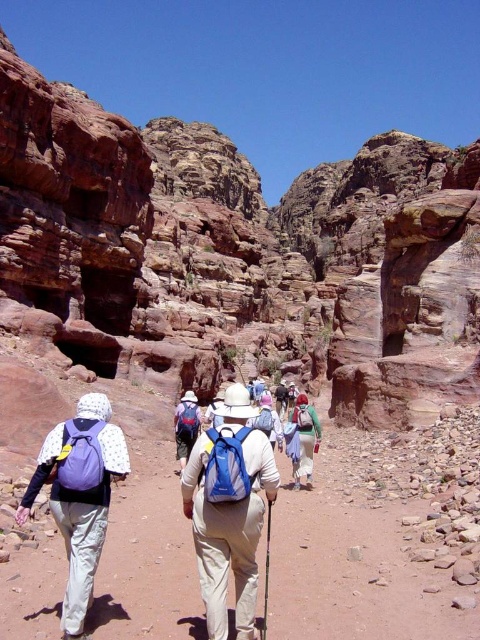
Can you confirm if purple fabric backpack at center-left is wider than matte blue backpack at center?

Yes.

What do you see at coordinates (80, 496) in the screenshot? I see `purple fabric backpack at center-left` at bounding box center [80, 496].

Identify the location of purple fabric backpack at center-left. (80, 496).

Who is shorter, purple fabric backpack at center-left or light brown leather backpack at center?

light brown leather backpack at center

Does purple fabric backpack at center-left lie in front of light brown leather backpack at center?

Yes.

Is point (17, 513) closer to viewer compared to point (278, 410)?

Yes, point (17, 513) is in front of point (278, 410).

Where is `purple fabric backpack at center-left`? This screenshot has width=480, height=640. purple fabric backpack at center-left is located at coordinates (80, 496).

Can you confirm if green fabric backpack at center is positioned above light brown leather backpack at center?

Yes, green fabric backpack at center is above light brown leather backpack at center.

Between point (312, 433) and point (284, 394), which one is positioned behind?

The point (284, 394) is more distant.

The image size is (480, 640). Identify the location of green fabric backpack at center. (304, 438).